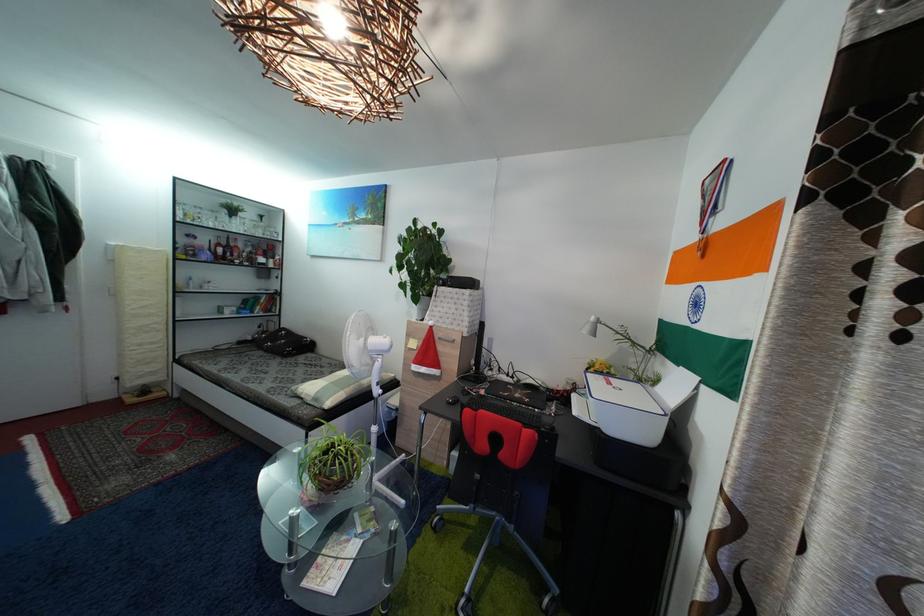
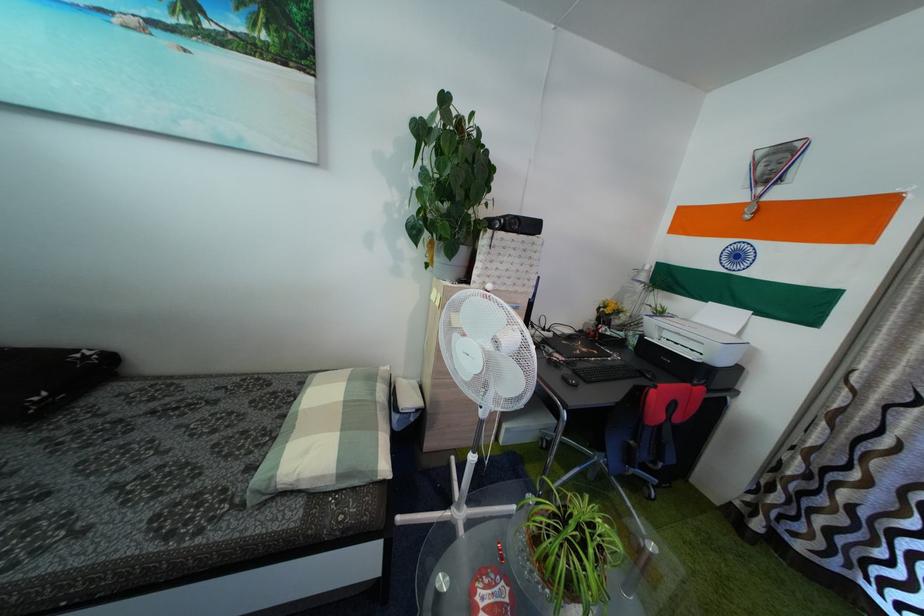
The point at (x=322, y=407) is marked in the first image. Where is the corresponding point in the second image?

(347, 483)